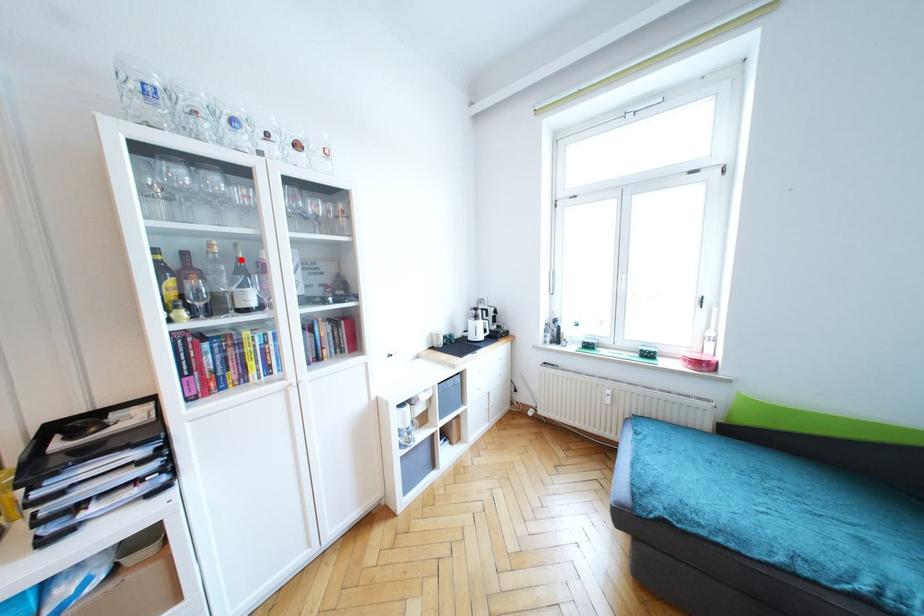
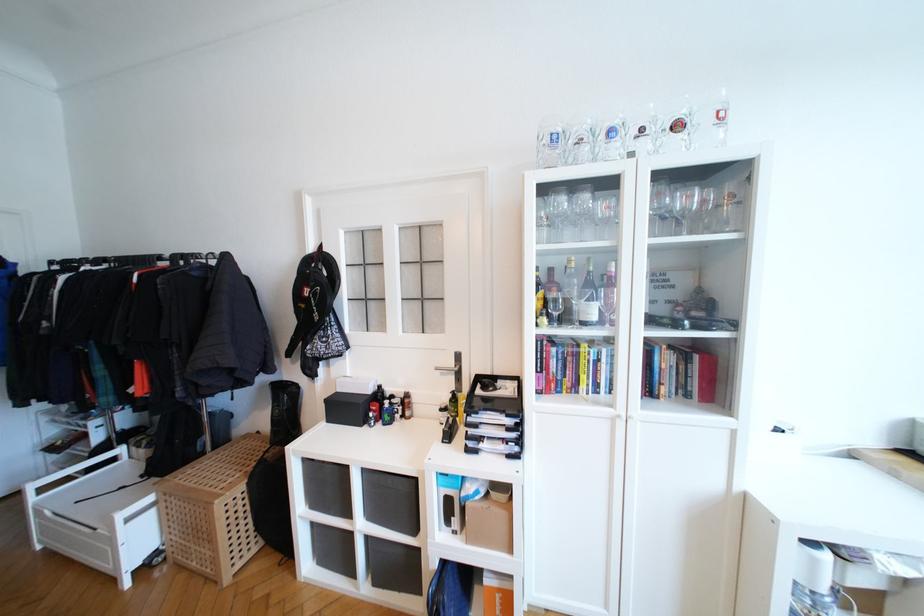
Question: I am providing you with two images of the same scene from different viewpoints. A red point is marked on the first image. Can you still see the location of the red point in image 2?

Choices:
 (A) Yes
 (B) No

Answer: (A)